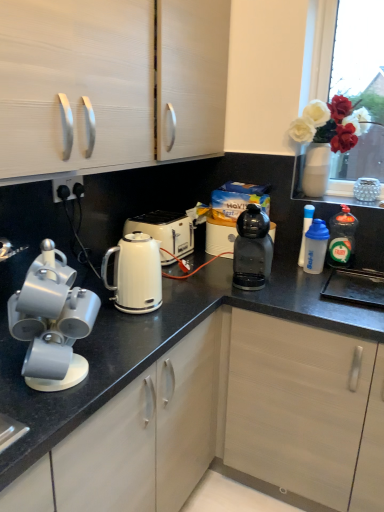
Question: Is matte white cabinet at upper left positioned with its back to translucent plastic dishwashing liquid at right, the 1th kitchen appliance in the right-to-left sequence?

Choices:
 (A) no
 (B) yes

Answer: (A)

Question: Does matte white cabinet at upper left appear on the right side of translucent plastic dishwashing liquid at right, the 1th kitchen appliance in the right-to-left sequence?

Choices:
 (A) yes
 (B) no

Answer: (B)

Question: Is matte white cabinet at upper left with translucent plastic dishwashing liquid at right, the 1th kitchen appliance in the right-to-left sequence?

Choices:
 (A) no
 (B) yes

Answer: (A)

Question: Could you tell me if matte white cabinet at upper left is facing translucent plastic dishwashing liquid at right, which ranks as the fifth kitchen appliance in left-to-right order?

Choices:
 (A) no
 (B) yes

Answer: (A)

Question: Does matte white cabinet at upper left appear on the left side of translucent plastic dishwashing liquid at right, which ranks as the fifth kitchen appliance in left-to-right order?

Choices:
 (A) yes
 (B) no

Answer: (A)

Question: Looking at their shapes, would you say white glossy kettle at center is wider or thinner than white plastic water bottle at right, the 3th kitchen appliance positioned from the right?

Choices:
 (A) thin
 (B) wide

Answer: (B)

Question: Is white glossy kettle at center situated inside white plastic water bottle at right, the 3th kitchen appliance from the left, or outside?

Choices:
 (A) outside
 (B) inside

Answer: (A)

Question: Is white glossy kettle at center in front of or behind white plastic water bottle at right, the 3th kitchen appliance positioned from the right, in the image?

Choices:
 (A) behind
 (B) front

Answer: (B)

Question: From a real-world perspective, is white glossy kettle at center physically located above or below white plastic water bottle at right, the 3th kitchen appliance from the left?

Choices:
 (A) below
 (B) above

Answer: (A)

Question: Considering the relative positions of translucent plastic water bottle at right, which appears as the fourth kitchen appliance when viewed from the left, and black plastic coffee machine at center, the second kitchen appliance viewed from the left, in the image provided, is translucent plastic water bottle at right, which appears as the fourth kitchen appliance when viewed from the left, to the left or to the right of black plastic coffee machine at center, the second kitchen appliance viewed from the left,?

Choices:
 (A) left
 (B) right

Answer: (B)

Question: In the image, is translucent plastic water bottle at right, which appears as the fourth kitchen appliance when viewed from the left, positioned in front of or behind black plastic coffee machine at center, the fourth kitchen appliance when ordered from right to left?

Choices:
 (A) front
 (B) behind

Answer: (B)

Question: Is translucent plastic water bottle at right, which appears as the fourth kitchen appliance when viewed from the left, inside or outside of black plastic coffee machine at center, the second kitchen appliance viewed from the left?

Choices:
 (A) outside
 (B) inside

Answer: (A)

Question: Considering the positions of translucent plastic water bottle at right, the 2th kitchen appliance positioned from the right, and black plastic coffee machine at center, the fourth kitchen appliance when ordered from right to left, in the image, is translucent plastic water bottle at right, the 2th kitchen appliance positioned from the right, taller or shorter than black plastic coffee machine at center, the fourth kitchen appliance when ordered from right to left,?

Choices:
 (A) tall
 (B) short

Answer: (B)

Question: Is point click(x=233, y=265) closer or farther from the camera than point click(x=332, y=259)?

Choices:
 (A) farther
 (B) closer

Answer: (A)

Question: From their relative heights in the image, would you say black plastic coffee machine at center, the second kitchen appliance viewed from the left, is taller or shorter than translucent plastic dishwashing liquid at right, which ranks as the fifth kitchen appliance in left-to-right order?

Choices:
 (A) short
 (B) tall

Answer: (B)